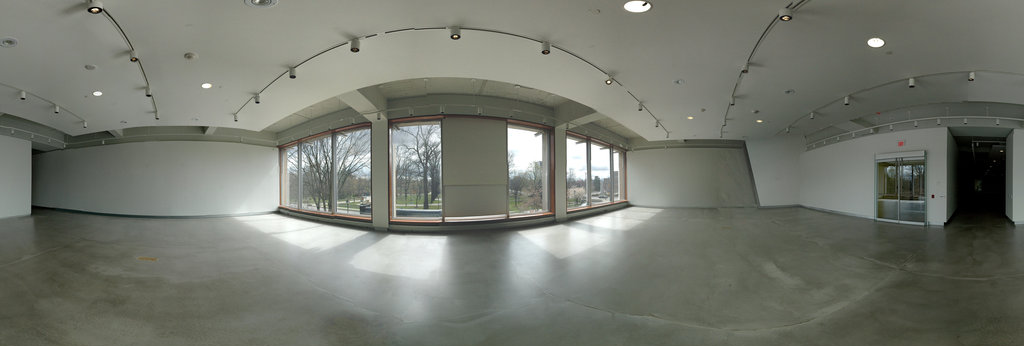
This screenshot has width=1024, height=346. I want to click on wall to left of windows, so click(x=158, y=184).